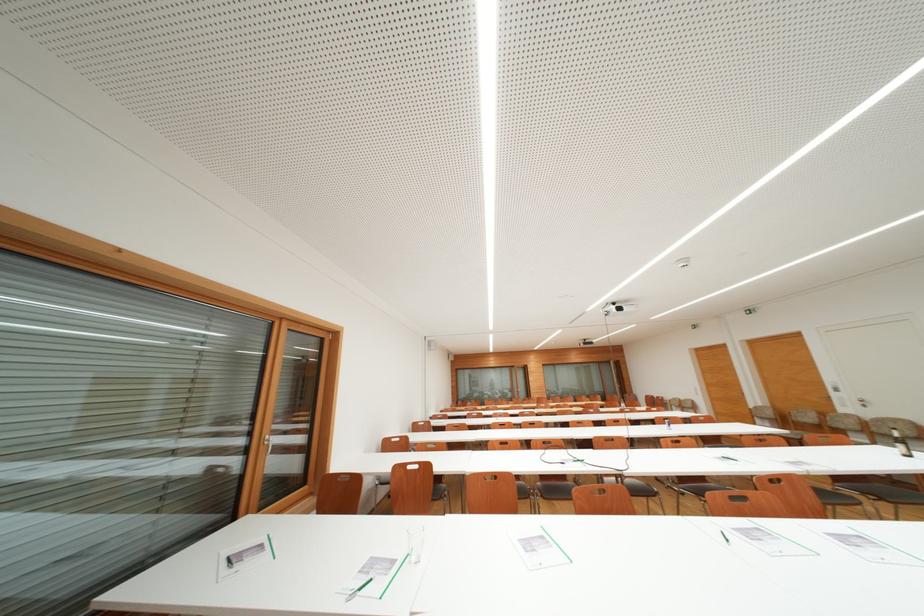
I want to click on silver door handle, so click(824, 395).